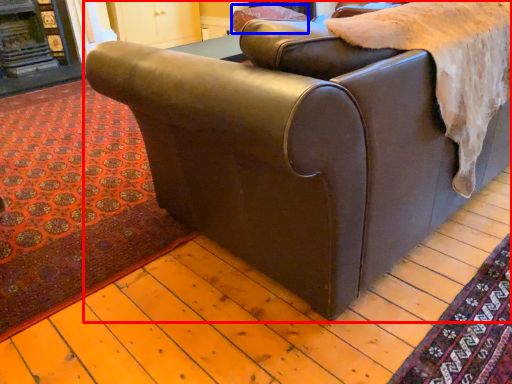
Question: Among these objects, which one is nearest to the camera, studio couch (highlighted by a red box) or pillow (highlighted by a blue box)?

Choices:
 (A) studio couch
 (B) pillow

Answer: (A)